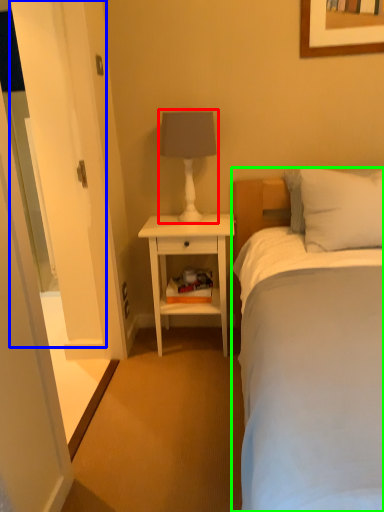
Question: Which object is the closest to the table lamp (highlighted by a red box)? Choose among these: glass door (highlighted by a blue box) or bed (highlighted by a green box).

Choices:
 (A) glass door
 (B) bed

Answer: (A)